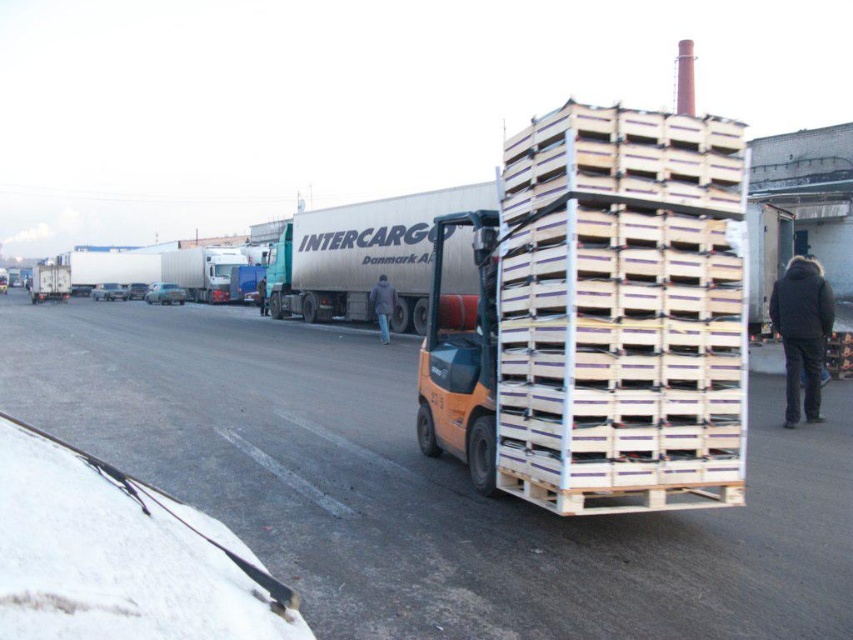
You are a delivery driver who needs to park your truck in a space that is 2.5 meters wide. You see the silver metallic trailer truck at center and the dark gray fabric jacket at center in the image. Based on their widths, can your truck fit into the parking space?

The silver metallic trailer truck at center might be wider than dark gray fabric jacket at center. If the trailer truck is wider than 2.5 meters, your truck may not fit into the parking space. However, without exact measurements, it is uncertain.

You are a delivery driver who needs to park your truck in the loading area shown in the image. There is a silver metallic trailer truck at center and a dark gray fabric jacket at center in the way. Can you safely drive your truck into the space between them?

The silver metallic trailer truck at center is positioned over dark gray fabric jacket at center, meaning they are stacked or aligned vertically. Since they are not side by side, there is no space between them for your truck to drive through safely. You should look for another parking spot.

You are a delivery person standing next to the silver metallic trailer truck at center and the dark gray fabric jacket at center. You need to place a box on top of the taller object. Which object should you choose?

The silver metallic trailer truck at center is taller than the dark gray fabric jacket at center, so you should place the box on top of the silver metallic trailer truck at center.